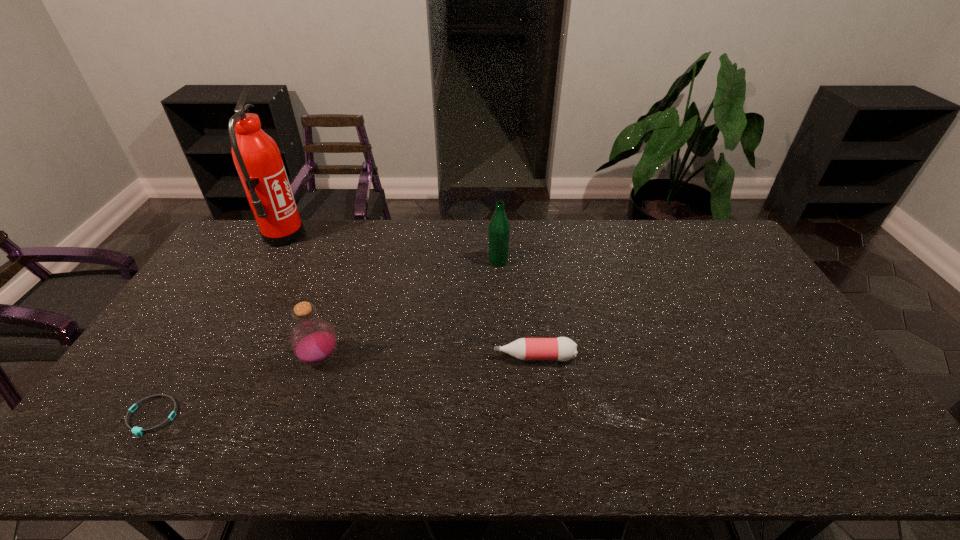
This screenshot has width=960, height=540. Identify the location of fire extinguisher. (257, 158).

Find the location of a particular element. This screenshot has width=960, height=540. the tallest object is located at coordinates (257, 158).

Identify the location of the second farthest object. (499, 228).

Where is `the tallest bottle`? The height and width of the screenshot is (540, 960). the tallest bottle is located at coordinates (499, 228).

This screenshot has height=540, width=960. I want to click on the leftmost bottle, so click(x=313, y=339).

Identify the location of the second tallest bottle. (313, 339).

At what (x,y) coordinates should I click in order to perform the action: click on the shortest bottle. Please return your answer as a coordinate pair (x, y). The image size is (960, 540). Looking at the image, I should click on (562, 348).

This screenshot has height=540, width=960. Identify the location of the nearest object. (135, 430).

Find the location of a particular element. This screenshot has height=540, width=960. the shortest object is located at coordinates (135, 430).

The image size is (960, 540). I want to click on free space located 0.170m on the label side of the fire extinguisher, so coord(348,237).